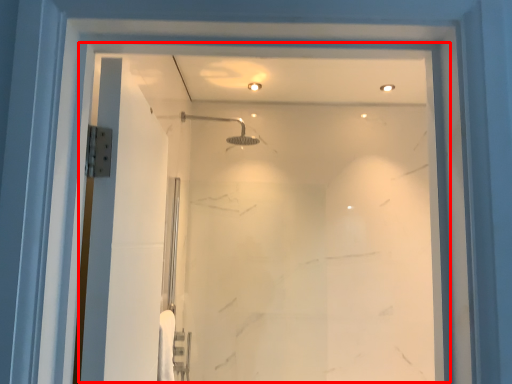
Question: In this image, where is glass door (annotated by the red box) located relative to shower?

Choices:
 (A) left
 (B) right

Answer: (B)